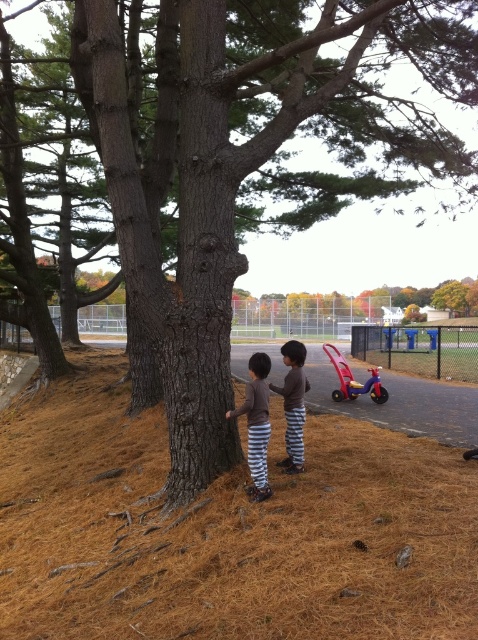
Is the position of brown textured tree trunk at center less distant than that of matte brown shirt at center?

That is False.

Who is positioned more to the left, brown textured tree trunk at center or matte brown shirt at center?

brown textured tree trunk at center

Is point (380, 406) in front of point (254, 493)?

No.

Locate an element on the screen. The image size is (478, 640). brown textured tree trunk at center is located at coordinates (225, 531).

Is brown textured tree trunk at center bigger than brown cotton shirt at center?

Actually, brown textured tree trunk at center might be smaller than brown cotton shirt at center.

Which is more to the left, brown textured tree trunk at center or brown cotton shirt at center?

brown textured tree trunk at center is more to the left.

Who is more forward, (431, 596) or (291, 454)?

Point (431, 596) is in front.

This screenshot has width=478, height=640. In order to click on brown textured tree trunk at center in this screenshot , I will do `click(225, 531)`.

Between point (264, 355) and point (299, 426), which one is positioned in front?

Point (264, 355) is more forward.

At what (x,y) coordinates should I click in order to perform the action: click on matte brown shirt at center. Please return your answer as a coordinate pair (x, y). This screenshot has width=478, height=640. Looking at the image, I should click on (257, 424).

What are the coordinates of `matte brown shirt at center` in the screenshot? It's located at (257, 424).